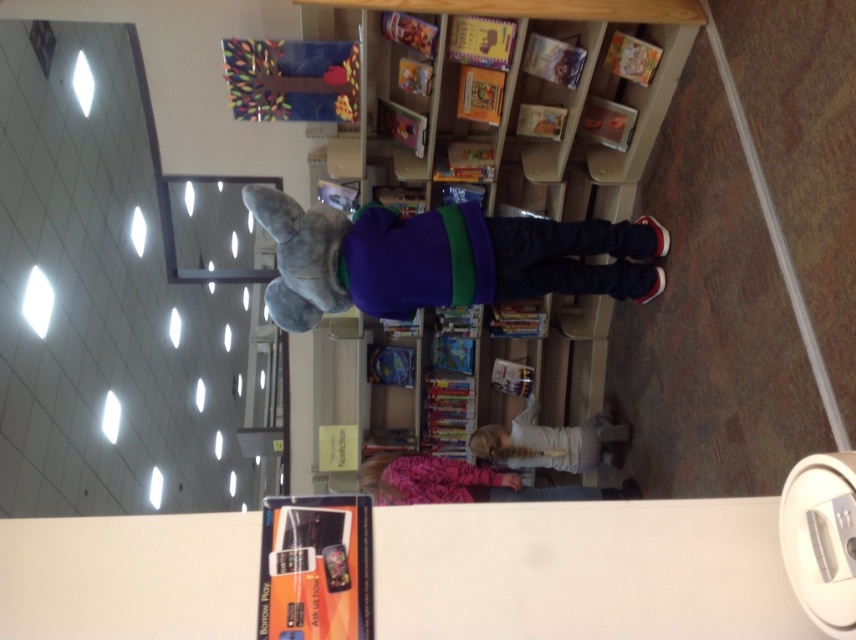
You are a delivery robot that is 20 inches wide. You need to move from the wooden bookcase at center to the plush gray elephant at center. Can you pass through the space between them?

The distance between the wooden bookcase at center and the plush gray elephant at center is 23.77 inches. Since the robot is 20 inches wide, it can pass through the space between them as the distance is wider than the robot.

You are standing in the library and see the wooden bookcase at center and the white matte shirt at center. Which object is positioned to the left?

The wooden bookcase at center is to the left of the white matte shirt at center.

You are a customer in a store and you see both the plush gray elephant at center and the pink fleece jacket at lower center. Which item is closer to you?

The plush gray elephant at center is closer to you because it is in front of the pink fleece jacket at lower center.